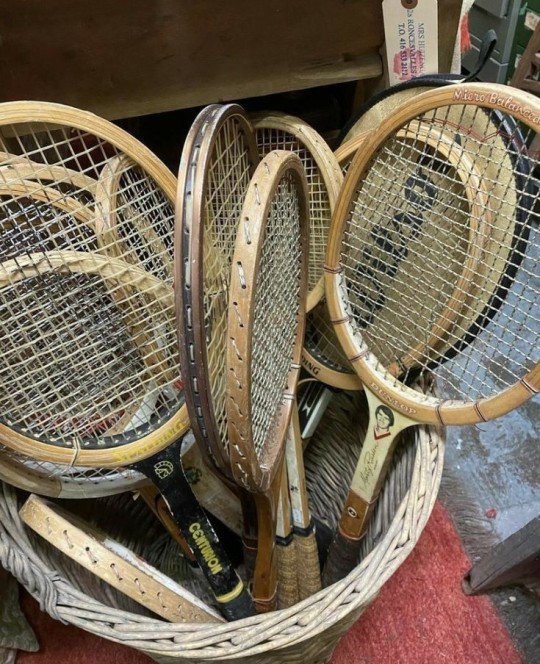
What are the coordinates of `carpet` in the screenshot? It's located at (455, 629).